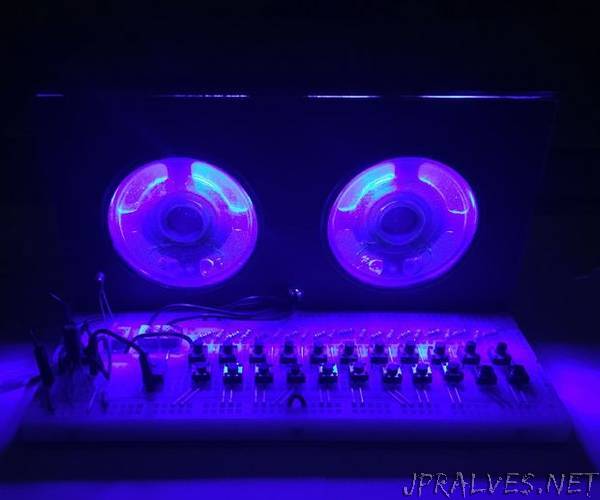
Where is `speakers`? This screenshot has height=500, width=600. speakers is located at coordinates (195, 215), (431, 205).